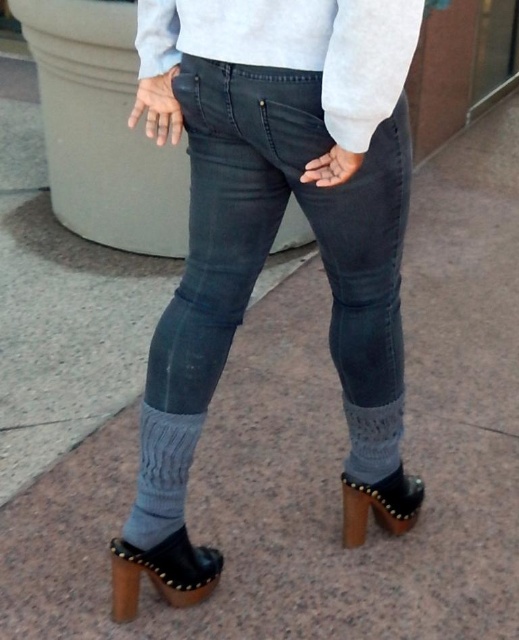
You are a fashion designer trying to create a new outfit. You have a light gray sweater at center and a matte black clog at lower right. How far apart are these two items in the image?

The light gray sweater at center is 37.42 inches away from the matte black clog at lower right.